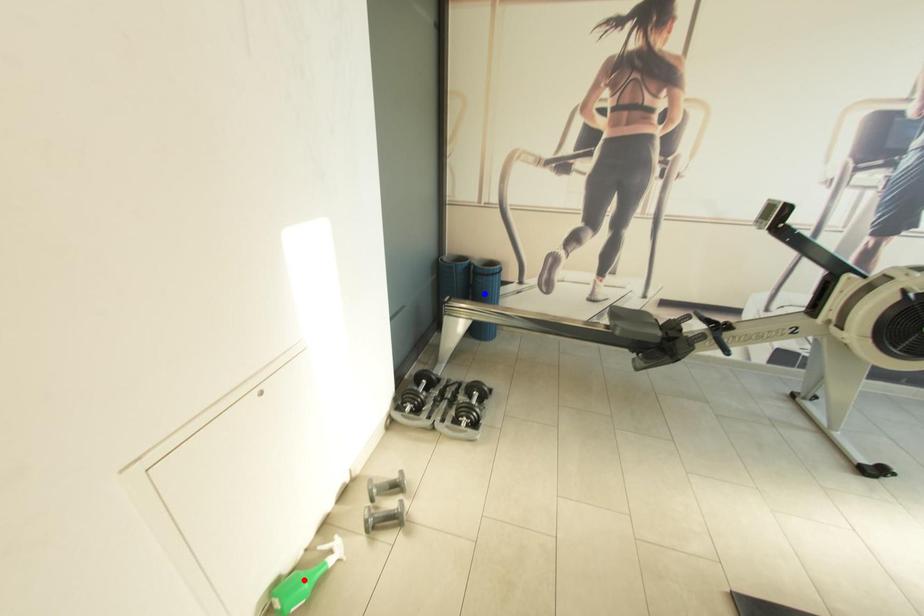
Question: Which of the two points in the image is closer to the camera?

Choices:
 (A) Blue point is closer.
 (B) Red point is closer.

Answer: (B)